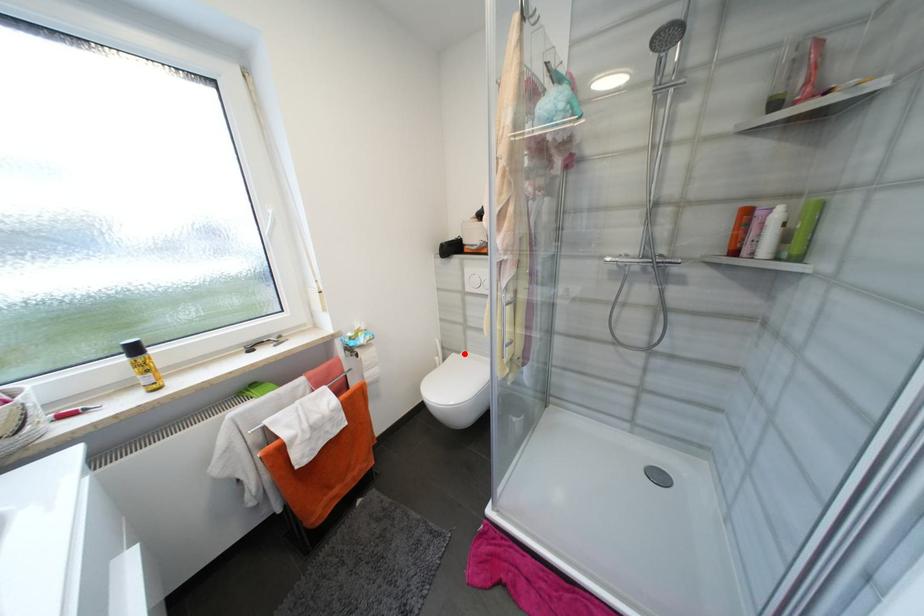
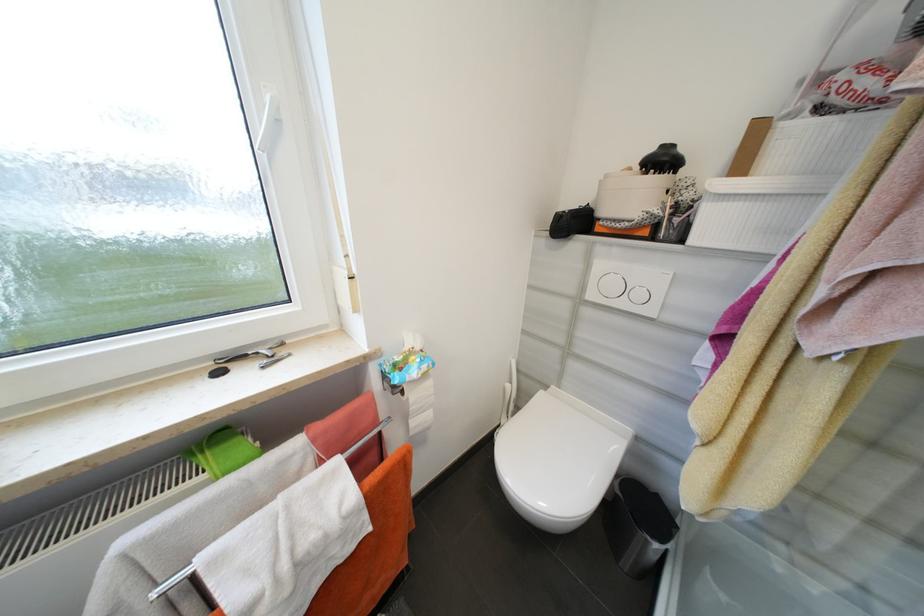
In the second image, find the point that corresponds to the highlighted location in the first image.

(552, 387)